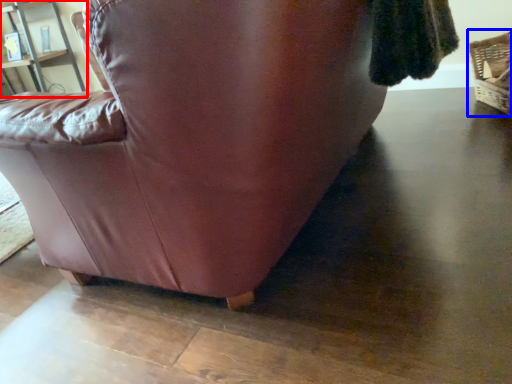
Question: Which object appears farthest to the camera in this image, shelf (highlighted by a red box) or basket (highlighted by a blue box)?

Choices:
 (A) shelf
 (B) basket

Answer: (A)